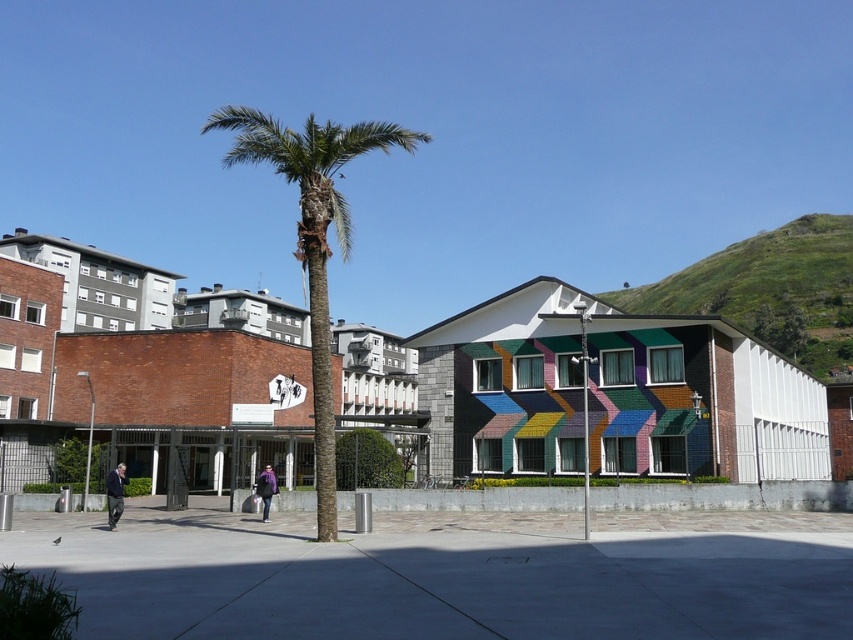
Question: Based on their relative distances, which object is nearer to the smooth concrete pavement at center?

Choices:
 (A) dark gray pants at lower left
 (B) green leafy palm tree at center
 (C) purple fabric bag at center

Answer: (C)

Question: Which of the following is the closest to the observer?

Choices:
 (A) (403, 129)
 (B) (265, 499)
 (C) (119, 502)

Answer: (C)

Question: Considering the relative positions of dark gray pants at lower left and purple fabric bag at center in the image provided, where is dark gray pants at lower left located with respect to purple fabric bag at center?

Choices:
 (A) below
 (B) above

Answer: (B)

Question: In this image, where is smooth concrete pavement at center located relative to dark gray pants at lower left?

Choices:
 (A) above
 (B) below

Answer: (A)

Question: Which of the following is the farthest from the observer?

Choices:
 (A) (212, 124)
 (B) (201, 588)
 (C) (108, 499)
 (D) (262, 497)

Answer: (A)

Question: Does green leafy palm tree at center lie in front of purple fabric bag at center?

Choices:
 (A) no
 (B) yes

Answer: (B)